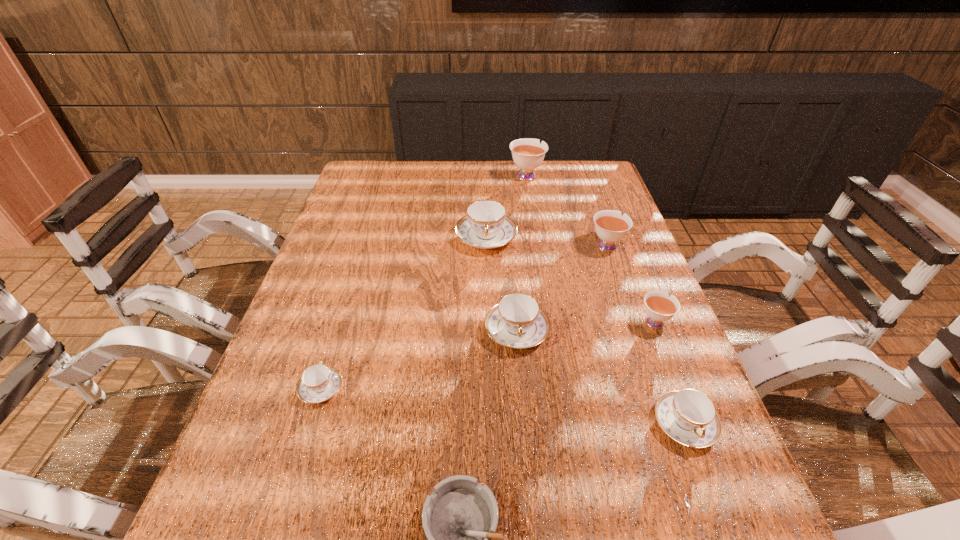
Locate an element on the screen. The height and width of the screenshot is (540, 960). free space located on the side of the second biggest white teacup with the handle is located at coordinates (583, 176).

Identify the location of vacant area located 0.400m on the side of the second biggest white teacup with the handle. (580, 167).

I want to click on free space located on the side of the second biggest white teacup with the handle, so click(580, 167).

Image resolution: width=960 pixels, height=540 pixels. Identify the location of free region located 0.340m on the side with the handle of the third nearest blue teacup. (533, 524).

Find the location of a particular element. The width and height of the screenshot is (960, 540). free spot located 0.050m on the side of the smallest white teacup with the handle is located at coordinates (643, 293).

At what (x,y) coordinates should I click in order to perform the action: click on free location located on the side of the smallest white teacup with the handle. Please return your answer as a coordinate pair (x, y). Looking at the image, I should click on (641, 288).

Identify the location of vacant space situated on the side of the smallest white teacup with the handle. (627, 251).

Locate an element on the screen. Image resolution: width=960 pixels, height=540 pixels. free location located on the side with the handle of the second smallest blue teacup is located at coordinates (706, 482).

Identify the location of free space located 0.320m on the side with the handle of the leftmost teacup. (357, 272).

This screenshot has height=540, width=960. I want to click on free space located 0.400m on the side with the handle of the leftmost teacup, so click(364, 253).